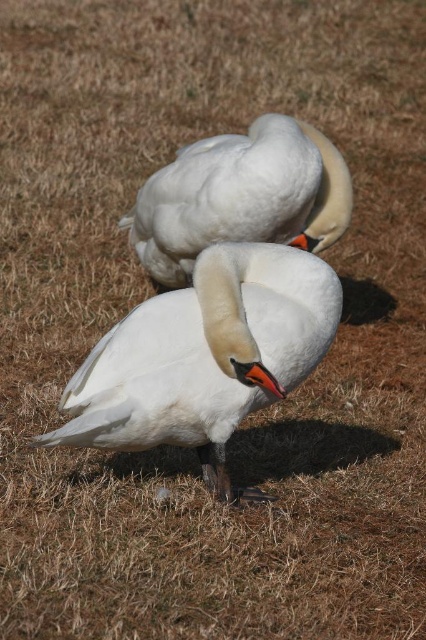
Question: Is white glossy swan at center smaller than white matte swan at center?

Choices:
 (A) yes
 (B) no

Answer: (A)

Question: Does white glossy swan at center lie behind white matte swan at center?

Choices:
 (A) no
 (B) yes

Answer: (A)

Question: Among these points, which one is farthest from the camera?

Choices:
 (A) (249, 273)
 (B) (299, 161)

Answer: (B)

Question: Is white glossy swan at center behind white matte swan at center?

Choices:
 (A) no
 (B) yes

Answer: (A)

Question: Which object appears closest to the camera in this image?

Choices:
 (A) white glossy swan at center
 (B) white matte swan at center

Answer: (A)